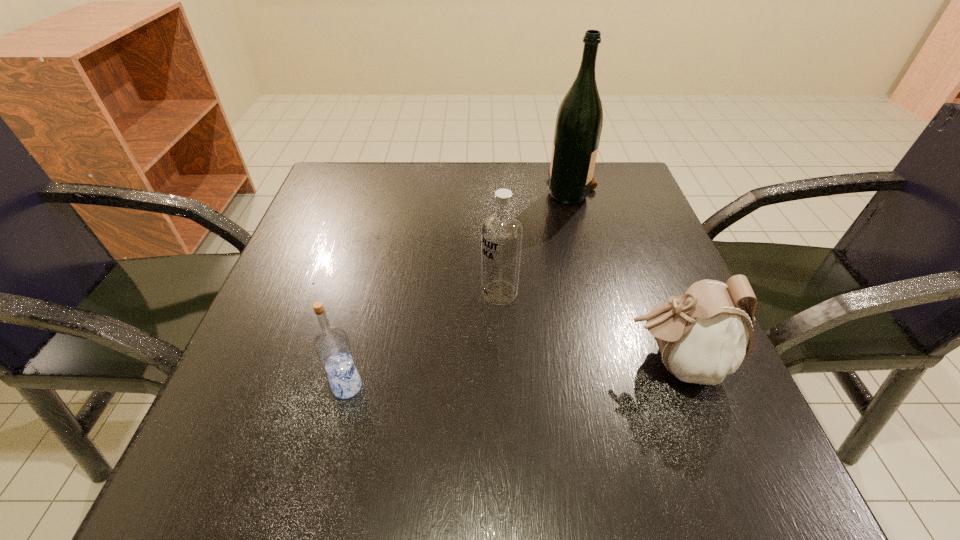
At what (x,y) coordinates should I click in order to perform the action: click on free area in between the pouch and the leftmost object. Please return your answer as a coordinate pair (x, y). The width and height of the screenshot is (960, 540). Looking at the image, I should click on (511, 375).

The width and height of the screenshot is (960, 540). I want to click on free space between the pouch and the farthest object, so click(623, 276).

In order to click on free space between the nearer vodka and the right vodka in this screenshot , I will do `click(423, 340)`.

I want to click on vacant region between the pouch and the second farthest object, so click(x=588, y=328).

I want to click on free area in between the tallest object and the taller vodka, so click(x=536, y=241).

Image resolution: width=960 pixels, height=540 pixels. Find the location of `empty location between the shorter vodka and the pouch`. empty location between the shorter vodka and the pouch is located at coordinates (511, 375).

Point out which object is positioned as the third nearest to the left vodka. Please provide its 2D coordinates. Your answer should be formatted as a tuple, i.e. [(x, y)], where the tuple contains the x and y coordinates of a point satisfying the conditions above.

[(579, 121)]

Select which object appears as the closest to the pouch. Please provide its 2D coordinates. Your answer should be formatted as a tuple, i.e. [(x, y)], where the tuple contains the x and y coordinates of a point satisfying the conditions above.

[(502, 232)]

You are a GUI agent. You are given a task and a screenshot of the screen. Output one action in this format:
    pyautogui.click(x=<x>, y=<y>)
    Task: Click on the vacant space that satisfies the following two spatial constraints: 1. on the front side of the tallest object; 2. on the front label of the right vodka
    Image resolution: width=960 pixels, height=540 pixels.
    Given the screenshot: What is the action you would take?
    pyautogui.click(x=600, y=293)

You are a GUI agent. You are given a task and a screenshot of the screen. Output one action in this format:
    pyautogui.click(x=<x>, y=<y>)
    Task: Click on the vacant space that satisfies the following two spatial constraints: 1. on the front side of the tallest object; 2. on the front label of the third nearest object
    The height and width of the screenshot is (540, 960).
    Given the screenshot: What is the action you would take?
    pos(600,293)